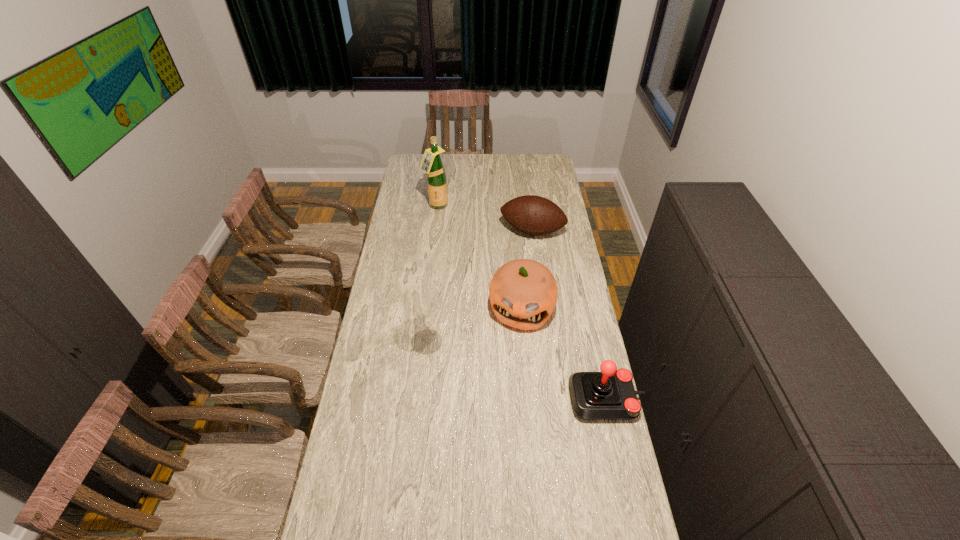
The width and height of the screenshot is (960, 540). In order to click on flute glass in this screenshot , I will do `click(420, 301)`.

At what (x,y) coordinates should I click in order to perform the action: click on the nearest object. Please return your answer as a coordinate pair (x, y). Looking at the image, I should click on (610, 394).

What are the coordinates of `the tallest object` in the screenshot? It's located at (431, 163).

Image resolution: width=960 pixels, height=540 pixels. I want to click on the farthest object, so click(431, 163).

Where is `the second farthest object`? Image resolution: width=960 pixels, height=540 pixels. the second farthest object is located at coordinates (535, 215).

Identify the location of pumpkin. (523, 293).

Image resolution: width=960 pixels, height=540 pixels. I want to click on vacant space located 0.380m on the front of the flute glass, so click(x=415, y=456).

Identify the location of vacant space located 0.060m on the front-facing side of the liquor. (443, 219).

Image resolution: width=960 pixels, height=540 pixels. Find the location of `free location located 0.330m on the front-facing side of the liquor`. free location located 0.330m on the front-facing side of the liquor is located at coordinates (457, 252).

Where is `vacant position located 0.170m on the front-facing side of the liquor`? vacant position located 0.170m on the front-facing side of the liquor is located at coordinates (448, 232).